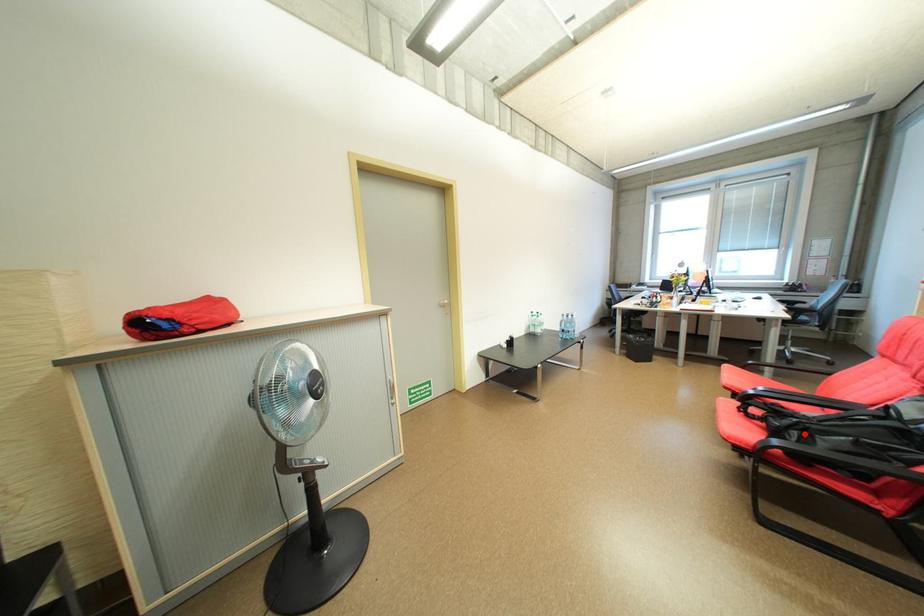
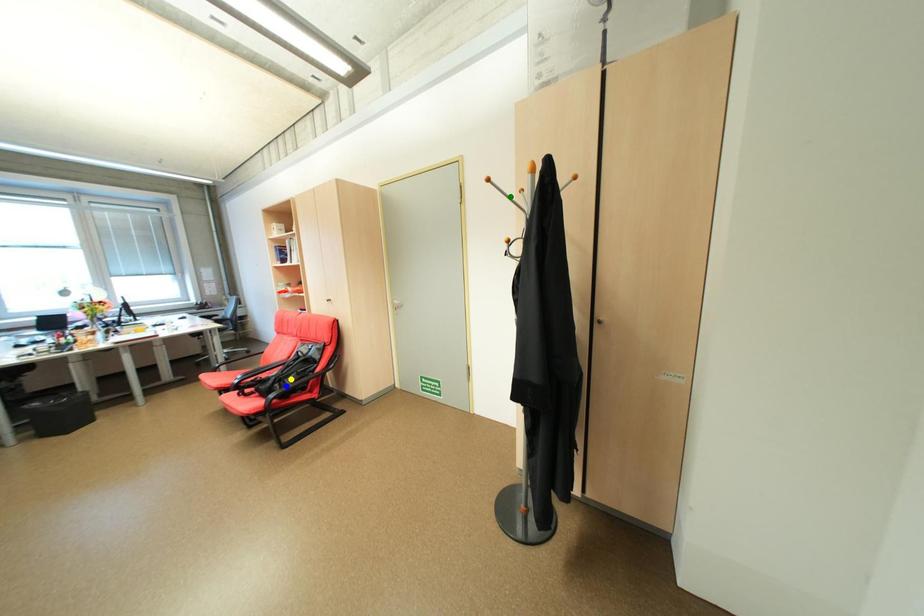
Question: I am providing you with two images of the same scene from different viewpoints. A red point is marked on the first image. You are given multiple points on the second image. Which mark in image 2 goes with the point in image 1?

Choices:
 (A) yellow point
 (B) green point
 (C) blue point

Answer: (C)